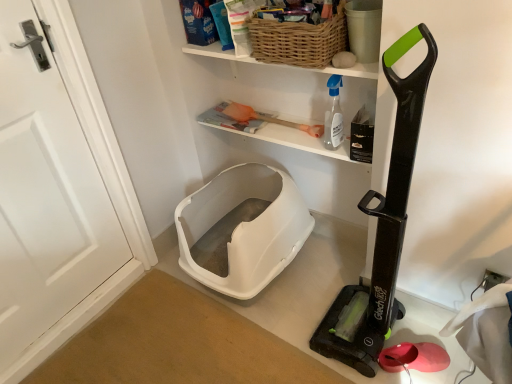
You are a GUI agent. You are given a task and a screenshot of the screen. Output one action in this format:
    pyautogui.click(x=<x>, y=<y>)
    Task: Click on the empty space that is ontop of woven brown basket at upper center
    The height and width of the screenshot is (384, 512).
    Given the screenshot: What is the action you would take?
    pyautogui.click(x=302, y=4)